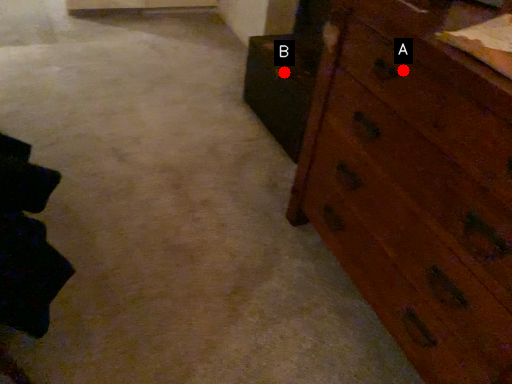
Question: Two points are circled on the image, labeled by A and B beside each circle. Which point is farther to the camera?

Choices:
 (A) A is further
 (B) B is further

Answer: (B)